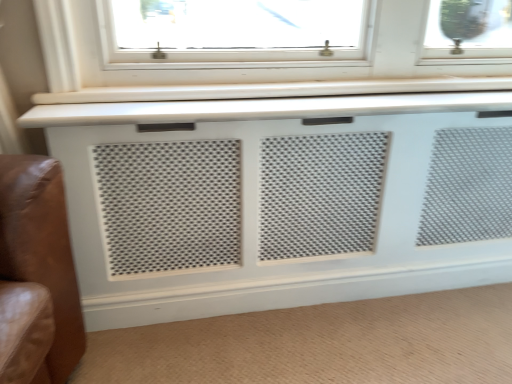
Question: Considering the relative positions of white perforated panel at lower center and white perforated grille at center in the image provided, is white perforated panel at lower center in front of white perforated grille at center?

Choices:
 (A) yes
 (B) no

Answer: (A)

Question: Can you confirm if white perforated panel at lower center is wider than white perforated grille at center?

Choices:
 (A) yes
 (B) no

Answer: (A)

Question: Is white perforated panel at lower center far away from white perforated grille at center?

Choices:
 (A) no
 (B) yes

Answer: (A)

Question: Is white perforated panel at lower center positioned behind white perforated grille at center?

Choices:
 (A) yes
 (B) no

Answer: (B)

Question: From the image's perspective, does white perforated panel at lower center appear higher than white perforated grille at center?

Choices:
 (A) no
 (B) yes

Answer: (A)

Question: Does white perforated panel at lower center appear on the left side of white perforated grille at center?

Choices:
 (A) yes
 (B) no

Answer: (A)

Question: From a real-world perspective, is white perforated grille at center over white perforated panel at lower center?

Choices:
 (A) yes
 (B) no

Answer: (A)

Question: From a real-world perspective, is white perforated grille at center physically below white perforated panel at lower center?

Choices:
 (A) no
 (B) yes

Answer: (A)

Question: Is white perforated grille at center closer to camera compared to white perforated panel at lower center?

Choices:
 (A) yes
 (B) no

Answer: (B)

Question: Considering the relative sizes of white perforated grille at center and white perforated panel at lower center in the image provided, is white perforated grille at center thinner than white perforated panel at lower center?

Choices:
 (A) no
 (B) yes

Answer: (B)

Question: Considering the relative positions of white perforated grille at center and white perforated panel at lower center in the image provided, is white perforated grille at center to the left of white perforated panel at lower center from the viewer's perspective?

Choices:
 (A) no
 (B) yes

Answer: (A)

Question: From the image's perspective, is white perforated grille at center located beneath white perforated panel at lower center?

Choices:
 (A) yes
 (B) no

Answer: (B)

Question: From the image's perspective, is white perforated grille at center above or below white perforated panel at lower center?

Choices:
 (A) above
 (B) below

Answer: (A)